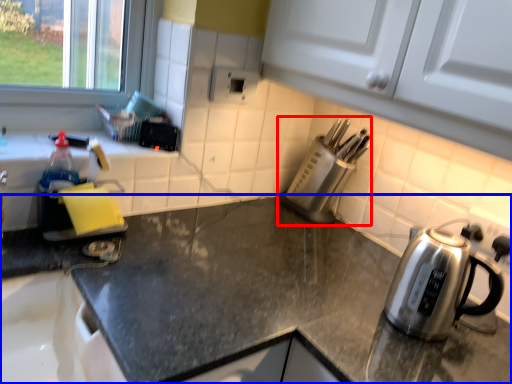
Question: Which object is further to the camera taking this photo, appliance (highlighted by a red box) or countertop (highlighted by a blue box)?

Choices:
 (A) appliance
 (B) countertop

Answer: (A)